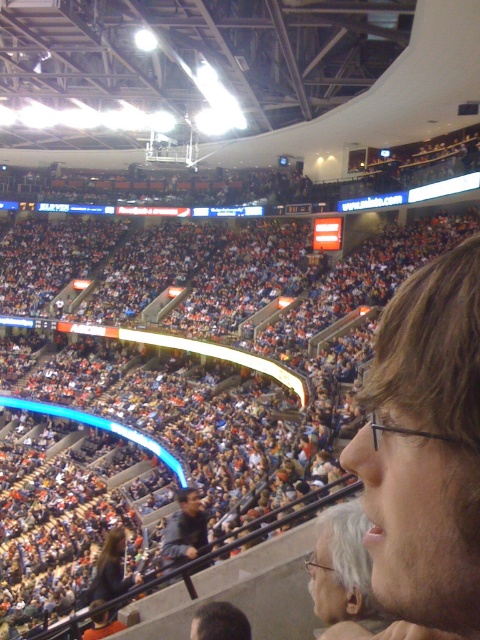
You are standing at the center of the arena and want to take a photo of the light brown hair at right. Which direction should you point your camera to capture it?

The light brown hair at right is located at point 0.700 on the x axis and 0.887 on the y axis, so you should point your camera to the right and slightly upwards to capture it.

You are sitting in the stands of the sports arena and want to take a photo of the game. There is a person with light brown hair at right and a person wearing a dark gray jacket at center in your view. Which of these two people is blocking your view more?

The light brown hair at right is positioned over dark gray jacket at center, so the light brown hair at right is blocking your view more.